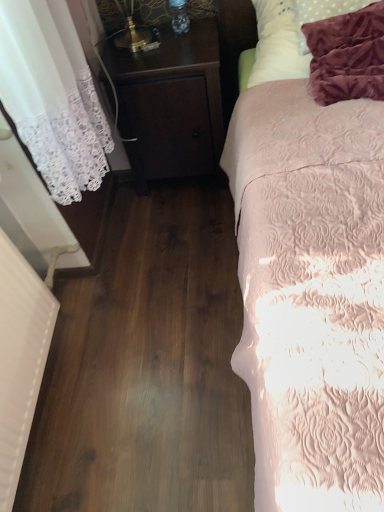
Locate an element on the screen. The width and height of the screenshot is (384, 512). dark wood nightstand at center is located at coordinates (171, 104).

In the scene shown: Is pink quilted bed at right bigger or smaller than dark wood nightstand at center?

pink quilted bed at right is bigger than dark wood nightstand at center.

Are pink quilted bed at right and dark wood nightstand at center beside each other?

There is a gap between pink quilted bed at right and dark wood nightstand at center.

Considering the relative sizes of pink quilted bed at right and dark wood nightstand at center in the image provided, is pink quilted bed at right thinner than dark wood nightstand at center?

No.

Is white soft pillow at upper right positioned with its back to pink quilted bed at right?

Yes.

How far apart are white soft pillow at upper right and pink quilted bed at right?

The distance of white soft pillow at upper right from pink quilted bed at right is 18.17 inches.

In the image, there is a white soft pillow at upper right. Find the location of `bed below it (from a real-world perspective)`. bed below it (from a real-world perspective) is located at coordinates (311, 293).

Is white soft pillow at upper right positioned far away from pink quilted bed at right?

white soft pillow at upper right is actually quite close to pink quilted bed at right.

Considering the relative sizes of dark wood nightstand at center and pink quilted bed at right in the image provided, is dark wood nightstand at center smaller than pink quilted bed at right?

Correct, dark wood nightstand at center occupies less space than pink quilted bed at right.

Measure the distance from dark wood nightstand at center to pink quilted bed at right.

The distance of dark wood nightstand at center from pink quilted bed at right is 21.75 inches.

Between dark wood nightstand at center and pink quilted bed at right, which one appears on the left side from the viewer's perspective?

From the viewer's perspective, dark wood nightstand at center appears more on the left side.

Is point (244, 193) positioned in front of point (282, 30)?

That is True.

Which object is closer to the camera, pink quilted bed at right or white soft pillow at upper right?

Positioned in front is pink quilted bed at right.

Between pink quilted bed at right and white soft pillow at upper right, which one has larger width?

pink quilted bed at right is wider.

Can you confirm if white soft pillow at upper right is bigger than dark wood nightstand at center?

Actually, white soft pillow at upper right might be smaller than dark wood nightstand at center.

Does white soft pillow at upper right appear on the left side of dark wood nightstand at center?

No.

Is point (272, 53) behind point (196, 45)?

No, (272, 53) is closer to viewer.

Based on the photo, can you confirm if dark wood nightstand at center is positioned to the left of white soft pillow at upper right?

Yes.

Is there a large distance between dark wood nightstand at center and white soft pillow at upper right?

They are positioned close to each other.

Is dark wood nightstand at center oriented towards white soft pillow at upper right?

No, dark wood nightstand at center is not turned towards white soft pillow at upper right.

Which of these two, dark wood nightstand at center or white soft pillow at upper right, is wider?

Wider between the two is white soft pillow at upper right.

In order to click on bed below the dark wood nightstand at center (from the image's perspective) in this screenshot , I will do `click(311, 293)`.

Identify the location of pillow that is on the right side of pink quilted bed at right. (290, 35).

Based on their spatial positions, is pink quilted bed at right or dark wood nightstand at center closer to white soft pillow at upper right?

dark wood nightstand at center lies closer to white soft pillow at upper right than the other object.

Based on their spatial positions, is dark wood nightstand at center or white soft pillow at upper right closer to pink quilted bed at right?

white soft pillow at upper right.

Considering their positions, is dark wood nightstand at center positioned closer to white soft pillow at upper right than pink quilted bed at right?

Based on the image, dark wood nightstand at center appears to be nearer to white soft pillow at upper right.

From the image, which object appears to be farther from dark wood nightstand at center, white soft pillow at upper right or pink quilted bed at right?

Based on the image, pink quilted bed at right appears to be further to dark wood nightstand at center.

Consider the image. Which object lies nearer to the anchor point dark wood nightstand at center, pink quilted bed at right or white soft pillow at upper right?

white soft pillow at upper right.

Estimate the real-world distances between objects in this image. Which object is closer to pink quilted bed at right, white soft pillow at upper right or dark wood nightstand at center?

white soft pillow at upper right lies closer to pink quilted bed at right than the other object.

You are a GUI agent. You are given a task and a screenshot of the screen. Output one action in this format:
    pyautogui.click(x=<x>, y=<y>)
    Task: Click on the pillow located between pink quilted bed at right and dark wood nightstand at center in the depth direction
    Image resolution: width=384 pixels, height=512 pixels.
    Given the screenshot: What is the action you would take?
    [x=290, y=35]